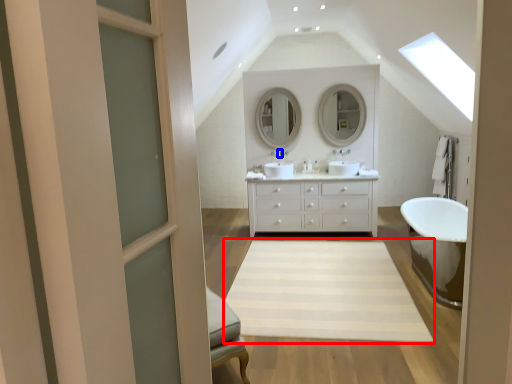
Question: Among these objects, which one is nearest to the camera, plain (highlighted by a red box) or faucet (highlighted by a blue box)?

Choices:
 (A) plain
 (B) faucet

Answer: (A)